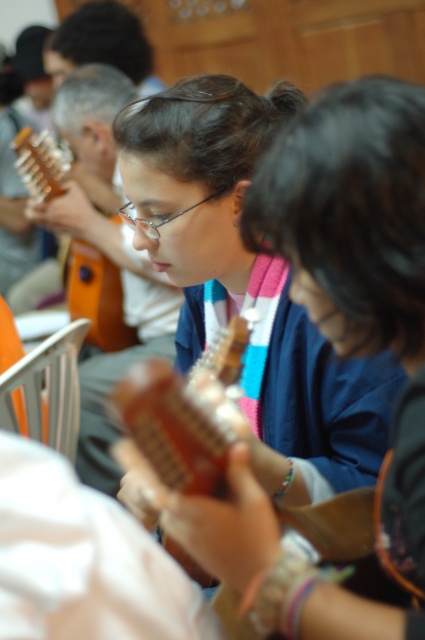
Question: Which point is closer to the camera?

Choices:
 (A) (192, 410)
 (B) (119, 296)

Answer: (A)

Question: Observing the image, what is the correct spatial positioning of wooden acoustic guitar at center in reference to matte brown guitar at left?

Choices:
 (A) below
 (B) above

Answer: (A)

Question: Which point is closer to the camera taking this photo?

Choices:
 (A) (20, 131)
 (B) (220, 340)

Answer: (B)

Question: Considering the relative positions of wooden acoustic guitar at center and matte brown guitar at left in the image provided, where is wooden acoustic guitar at center located with respect to matte brown guitar at left?

Choices:
 (A) left
 (B) right

Answer: (B)

Question: In this image, where is wooden acoustic guitar at center located relative to matte brown guitar at left?

Choices:
 (A) left
 (B) right

Answer: (B)